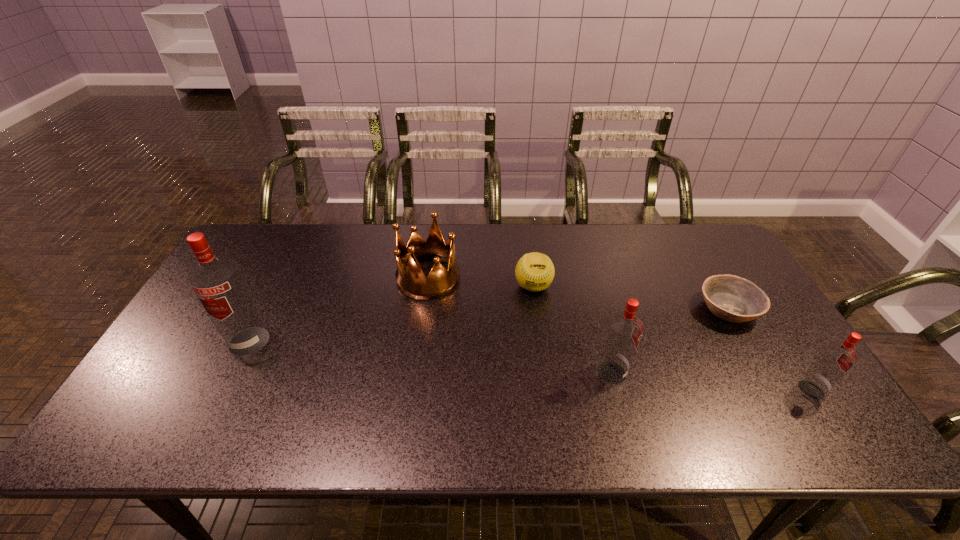
The width and height of the screenshot is (960, 540). I want to click on unoccupied position between the shortest object and the tallest object, so click(x=489, y=325).

The height and width of the screenshot is (540, 960). I want to click on vacant area between the fifth shortest object and the crown, so click(519, 325).

Find the location of a particular element. Image resolution: width=960 pixels, height=540 pixels. unoccupied area between the crown and the tallest vodka is located at coordinates (339, 309).

Select which object appears as the closest to the second object from left to right. Please provide its 2D coordinates. Your answer should be formatted as a tuple, i.e. [(x, y)], where the tuple contains the x and y coordinates of a point satisfying the conditions above.

[(534, 271)]

Image resolution: width=960 pixels, height=540 pixels. In order to click on object that is the third closest to the second shortest object in this screenshot , I will do `click(731, 298)`.

At what (x,y) coordinates should I click in order to perform the action: click on the second closest vodka to the rightmost vodka. Please return your answer as a coordinate pair (x, y). This screenshot has height=540, width=960. Looking at the image, I should click on (217, 281).

Where is `vodka that can be found as the second closest to the fifth shortest object`? vodka that can be found as the second closest to the fifth shortest object is located at coordinates (217, 281).